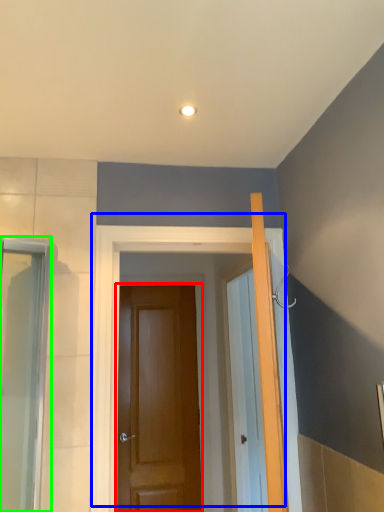
Question: Based on their relative distances, which object is farther from door (highlighted by a red box)? Choose from door (highlighted by a blue box) and screen door (highlighted by a green box).

Choices:
 (A) door
 (B) screen door

Answer: (B)